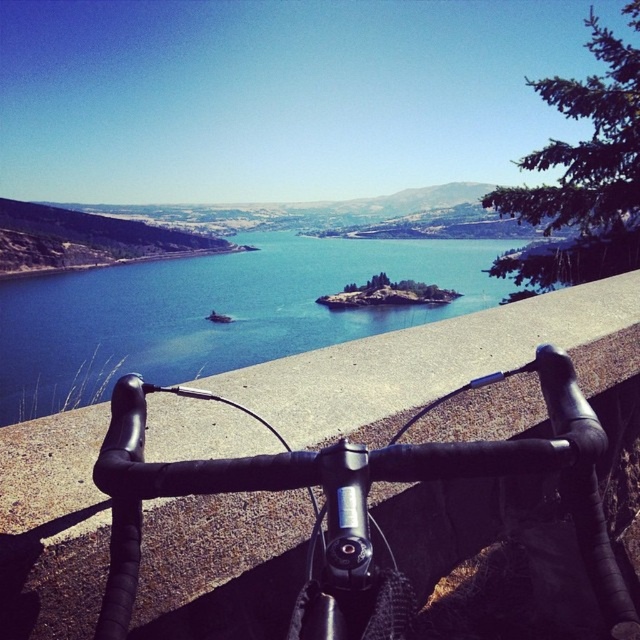
Question: Among these objects, which one is farthest from the camera?

Choices:
 (A) blue water at center
 (B) black matte bicycle handlebars at center

Answer: (A)

Question: Can you confirm if blue water at center is positioned to the left of black matte bicycle handlebars at center?

Choices:
 (A) yes
 (B) no

Answer: (A)

Question: Which object is farther from the camera taking this photo?

Choices:
 (A) blue water at center
 (B) black matte bicycle handlebars at center

Answer: (A)

Question: Is blue water at center above black matte bicycle handlebars at center?

Choices:
 (A) yes
 (B) no

Answer: (A)

Question: Can you confirm if blue water at center is positioned above black matte bicycle handlebars at center?

Choices:
 (A) no
 (B) yes

Answer: (B)